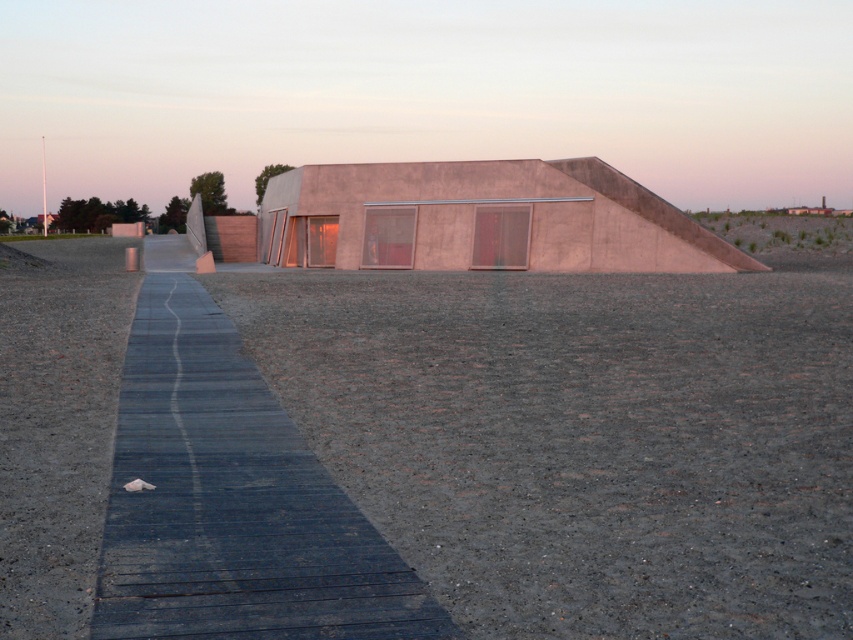
Can you confirm if gray gravel at center is positioned below dark gray wooden path at center?

Yes, gray gravel at center is below dark gray wooden path at center.

Can you confirm if gray gravel at center is thinner than dark gray wooden path at center?

No.

Where is `gray gravel at center`? gray gravel at center is located at coordinates (582, 440).